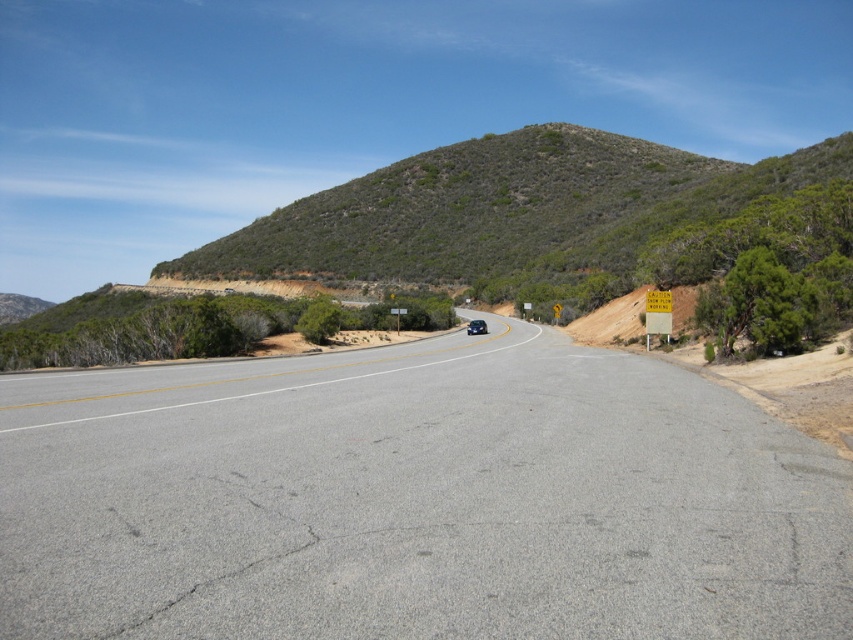
You are standing at the point with coordinates (416, 499) in the image. Based on the scene description, what object are you most likely standing on?

The point with coordinates (416, 499) corresponds to the gray asphalt road at center, so you are most likely standing on the gray asphalt road at center.

You are driving a car and see two points on the road ahead. The first point is at coordinate point(x=660, y=310) and the second is at point(x=471, y=330). If you are moving forward along the road, which point will you encounter first?

Point(x=660, y=310) is in front of point(x=471, y=330), so you will encounter point(x=660, y=310) first as you move forward along the road.